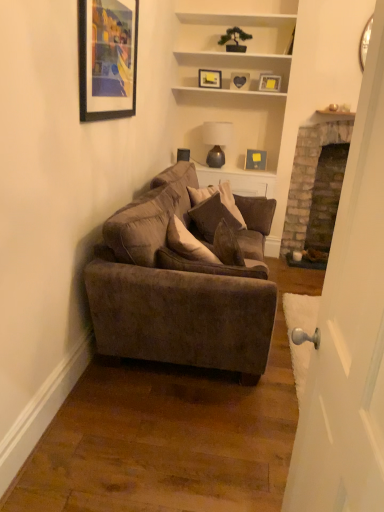
Question: Looking at their shapes, would you say matte gold picture frame at upper center, marked as the 1th picture frame in a right-to-left arrangement, is wider or thinner than suede-like brown pillow at center?

Choices:
 (A) wide
 (B) thin

Answer: (B)

Question: Is point (264, 81) positioned closer to the camera than point (203, 202)?

Choices:
 (A) closer
 (B) farther

Answer: (B)

Question: Which object is the farthest from the suede-like brown pillow at center?

Choices:
 (A) velvet brown couch at center
 (B) matte black picture frame at upper center, positioned as the 4th picture frame in left-to-right order
 (C) heart-shaped frame at upper center, marked as the third picture frame in a right-to-left arrangement
 (D) matte black picture frame at upper left, which is counted as the 1th picture frame, starting from the front
 (E) brick fireplace at right

Answer: (C)

Question: Estimate the real-world distances between objects in this image. Which object is farther from the white glossy door at right?

Choices:
 (A) matte black picture frame at upper center, acting as the second picture frame starting from the right
 (B) velvet brown couch at center
 (C) brick fireplace at right
 (D) suede-like brown pillow at center
 (E) matte gray lampshade at upper center

Answer: (A)